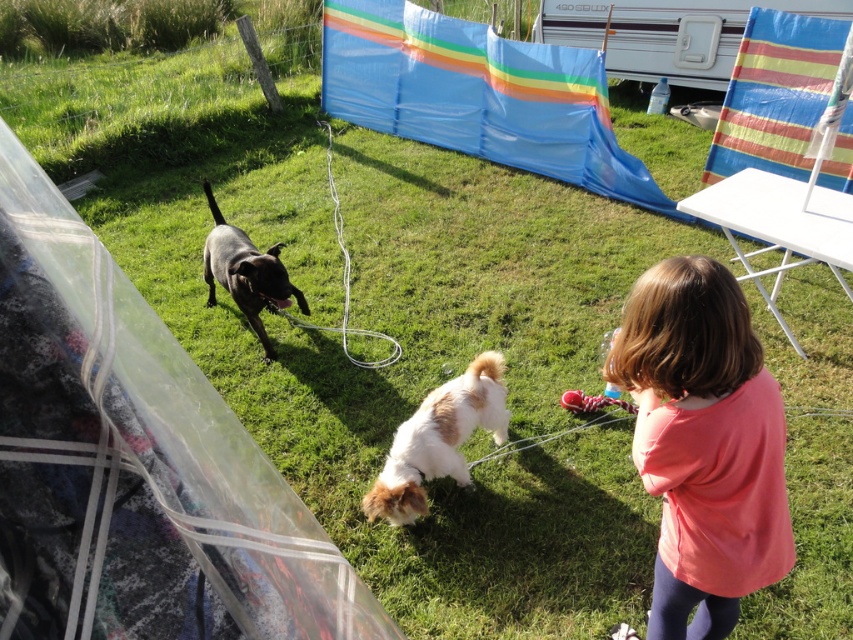
You are taking a photo of the scene and want to focus on both the white dog with brown patches and the blue tarp with colorful stripes. Given their positions at point (666, 316) and point (229, 284) respectively, which one is closer to your camera lens?

Point (666, 316) is closer to the camera than point (229, 284), so the white dog with brown patches is closer to your camera lens.

You are standing at the point with coordinates (703,444) in the image. What object are you currently standing on?

The point with coordinates (703,444) is on the pink cotton shirt at lower right.

Looking at this image, you are a photographer trying to capture a photo of both the brown and white fur at center and the shiny black dog at center. Since you want them both in the frame, can you tell me which one is on the right side so you can adjust your camera accordingly?

The brown and white fur at center is positioned on the right side of shiny black dog at center, so you should adjust your camera to focus on the right side to include both in the frame.